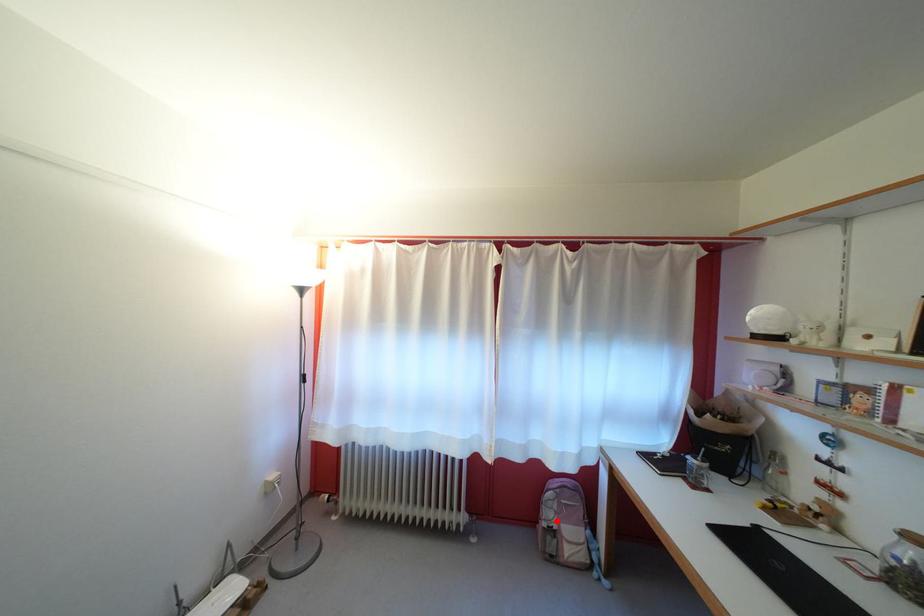
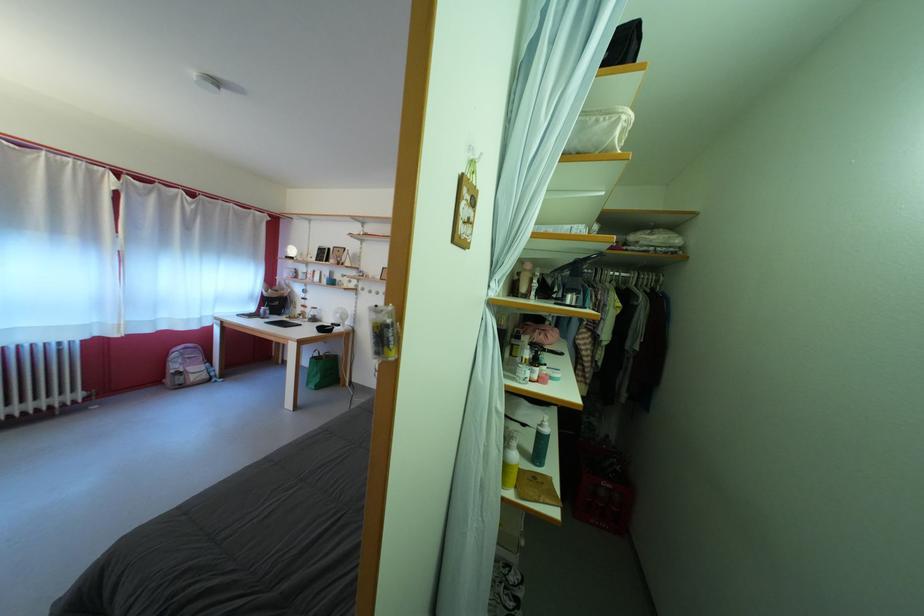
Question: I am providing you with two images of the same scene from different viewpoints. Image1 has a red point marked. In image2, the corresponding 3D location appears at what relative position? Reply with the corresponding letter.

Choices:
 (A) Closer
 (B) Farther

Answer: (A)